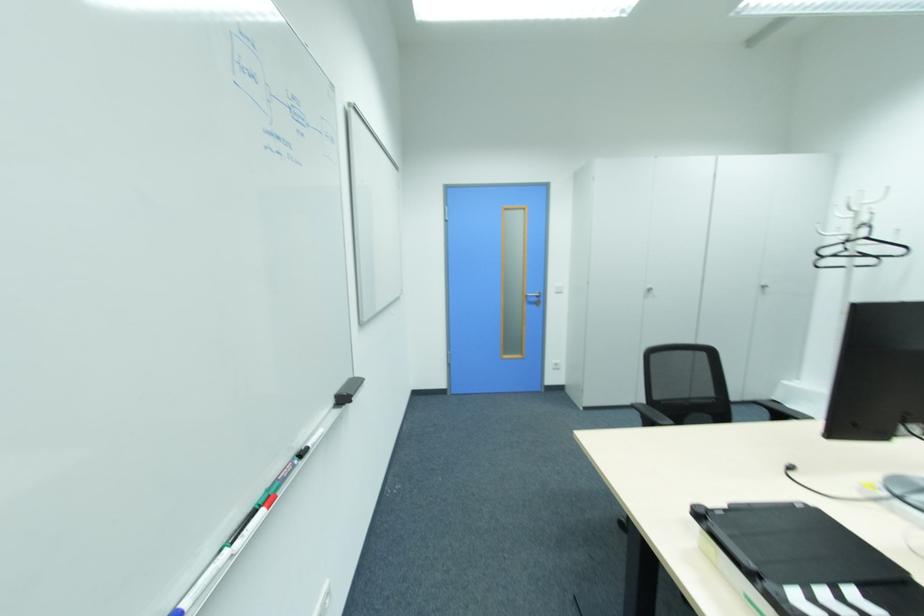
The height and width of the screenshot is (616, 924). What do you see at coordinates (855, 216) in the screenshot?
I see `the white coat hook` at bounding box center [855, 216].